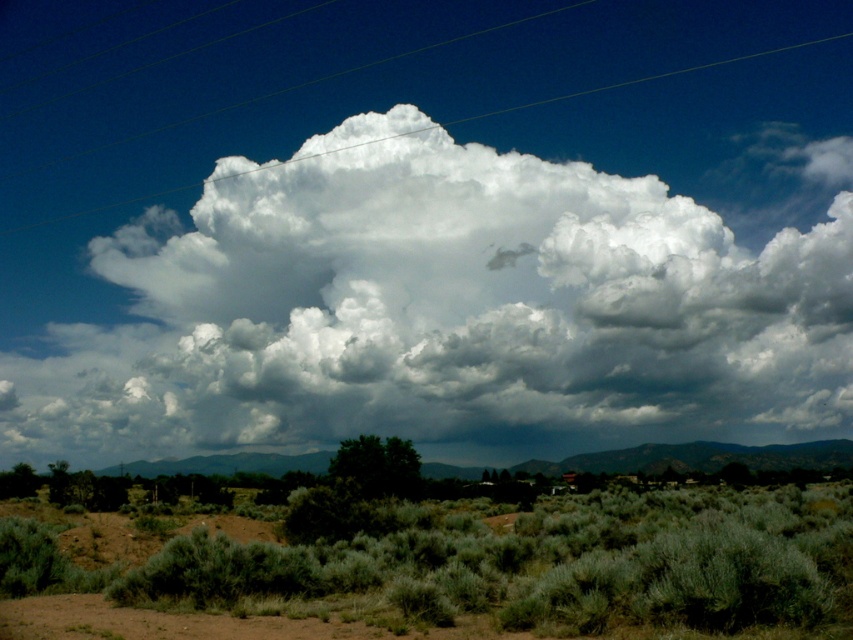
You are a bird flying over the landscape. You see the green shrubbery at lower center and the clear plastic power lines at upper center. Which object is positioned to the right side of the other?

The green shrubbery at lower center is to the right of clear plastic power lines at upper center.

You are an astronomer observing the sky and the landscape. You notice the white fluffy cloud at upper center and the green shrubbery at lower center. Which object is closer to your viewpoint?

The white fluffy cloud at upper center is closer to your viewpoint because the green shrubbery at lower center is behind it.